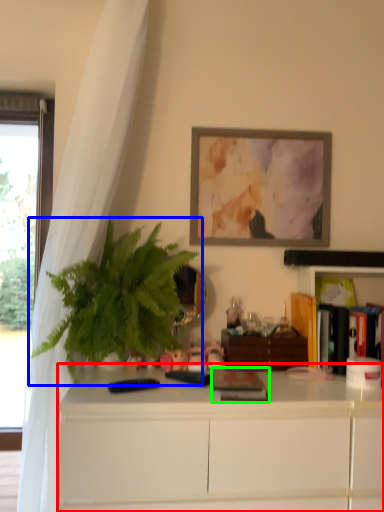
Question: Which is farther away from cabinetry (highlighted by a red box)? houseplant (highlighted by a blue box) or book (highlighted by a green box)?

Choices:
 (A) houseplant
 (B) book

Answer: (A)